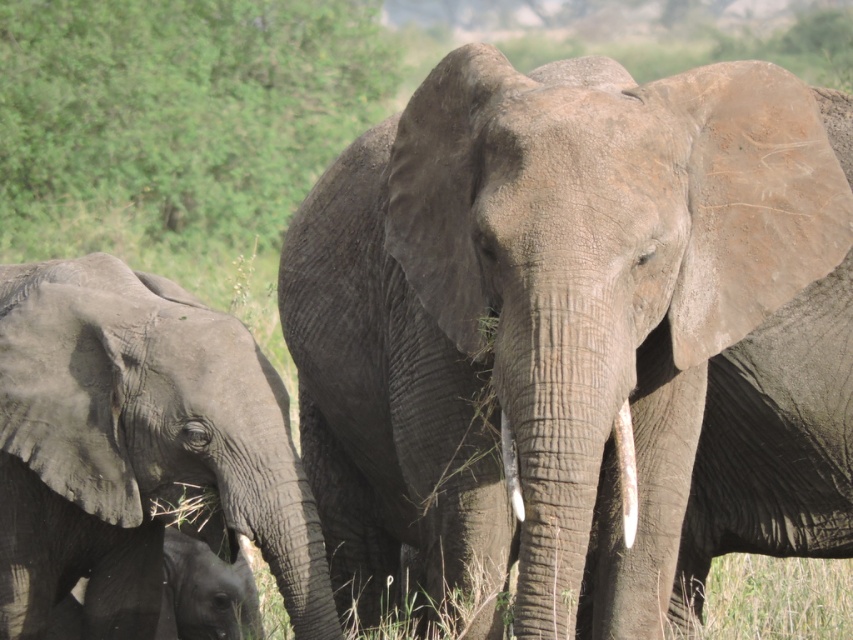
Is gray matte elephant at lower left above white ivory tusk at center?

No.

Is gray matte elephant at lower left further to camera compared to white ivory tusk at center?

That is True.

Between point (93, 461) and point (631, 438), which one is positioned in front?

Point (631, 438)

The height and width of the screenshot is (640, 853). I want to click on gray matte elephant at lower left, so click(x=136, y=445).

Identify the location of gray textured elephant at center. The image size is (853, 640). (578, 332).

This screenshot has width=853, height=640. What are the coordinates of `gray textured elephant at center` in the screenshot? It's located at [x=578, y=332].

Find the location of `gray textured elephant at center`. gray textured elephant at center is located at coordinates (578, 332).

Who is taller, gray textured elephant at center or gray matte elephant at lower left?

gray textured elephant at center

Looking at this image, can you confirm if gray textured elephant at center is shorter than gray matte elephant at lower left?

No, gray textured elephant at center is not shorter than gray matte elephant at lower left.

Which is in front, point (370, 561) or point (93, 312)?

Point (93, 312) is in front.

Where is `gray textured elephant at center`? This screenshot has height=640, width=853. gray textured elephant at center is located at coordinates (578, 332).